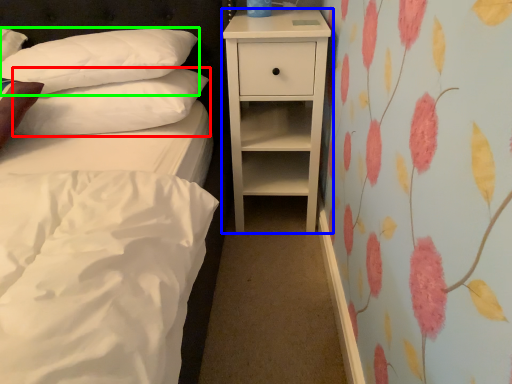
Question: Based on their relative distances, which object is nearer to pillow (highlighted by a red box)? Choose from nightstand (highlighted by a blue box) and pillow (highlighted by a green box).

Choices:
 (A) nightstand
 (B) pillow

Answer: (B)